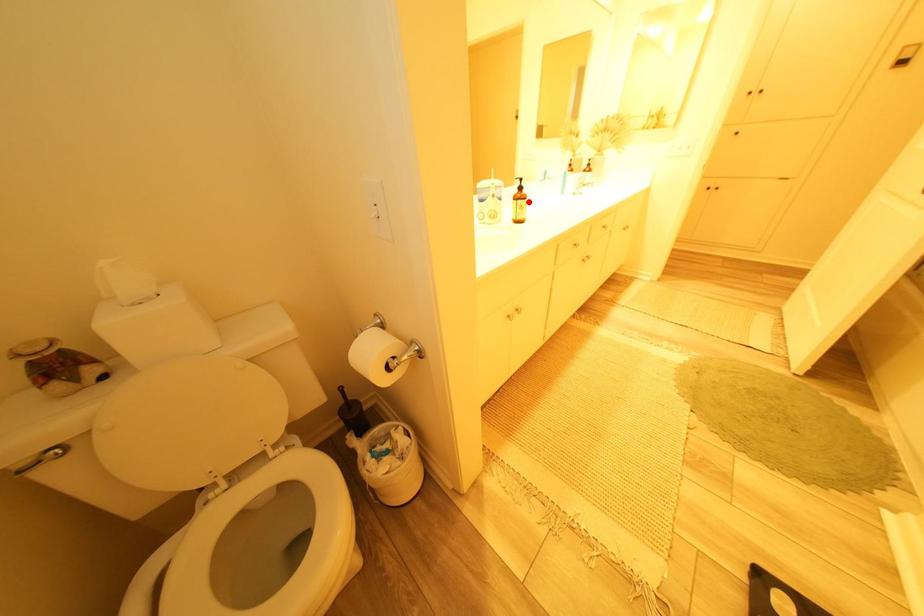
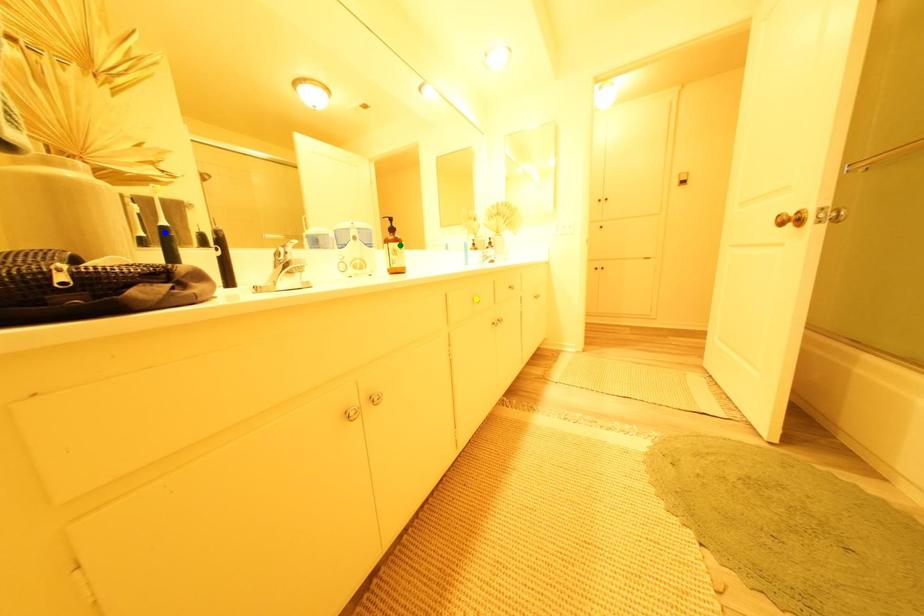
Question: I am providing you with two images of the same scene from different viewpoints. A red point is marked on the first image. You are given multiple points on the second image. Can you choose the point in image 2 that corresponds to the point in image 1?

Choices:
 (A) blue point
 (B) yellow point
 (C) green point

Answer: (C)